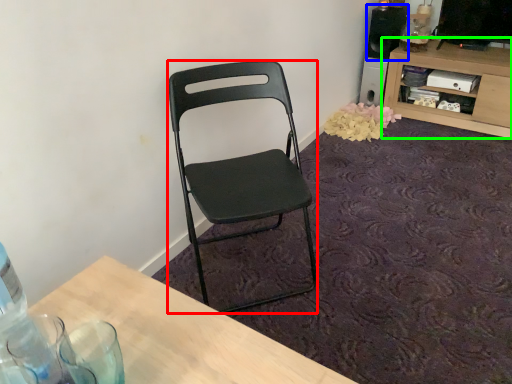
Question: Based on their relative distances, which object is nearer to chair (highlighted by a red box)? Choose from loudspeaker (highlighted by a blue box) and shelf (highlighted by a green box).

Choices:
 (A) loudspeaker
 (B) shelf

Answer: (B)